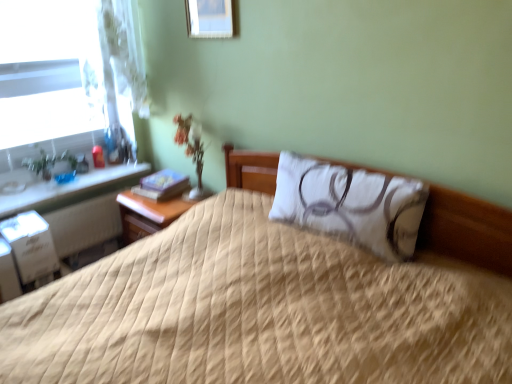
Question: Is wooden picture frame at upper center outside of clear glass window at left?

Choices:
 (A) no
 (B) yes

Answer: (B)

Question: From a real-world perspective, is wooden picture frame at upper center on top of clear glass window at left?

Choices:
 (A) yes
 (B) no

Answer: (A)

Question: Is wooden picture frame at upper center oriented away from clear glass window at left?

Choices:
 (A) yes
 (B) no

Answer: (B)

Question: Considering the relative sizes of wooden picture frame at upper center and clear glass window at left in the image provided, is wooden picture frame at upper center wider than clear glass window at left?

Choices:
 (A) no
 (B) yes

Answer: (A)

Question: From the image's perspective, is wooden picture frame at upper center located beneath clear glass window at left?

Choices:
 (A) no
 (B) yes

Answer: (A)

Question: From the image's perspective, relative to white quilted pillow at center, is beige quilted bed at center above or below?

Choices:
 (A) above
 (B) below

Answer: (B)

Question: Is beige quilted bed at center taller or shorter than white quilted pillow at center?

Choices:
 (A) short
 (B) tall

Answer: (B)

Question: Based on their sizes in the image, would you say beige quilted bed at center is bigger or smaller than white quilted pillow at center?

Choices:
 (A) big
 (B) small

Answer: (A)

Question: Is point (117, 256) positioned closer to the camera than point (314, 228)?

Choices:
 (A) farther
 (B) closer

Answer: (A)

Question: From a real-world perspective, is wooden picture frame at upper center above or below white quilted pillow at center?

Choices:
 (A) above
 (B) below

Answer: (A)

Question: From the image's perspective, is wooden picture frame at upper center located above or below white quilted pillow at center?

Choices:
 (A) below
 (B) above

Answer: (B)

Question: Looking at their shapes, would you say wooden picture frame at upper center is wider or thinner than white quilted pillow at center?

Choices:
 (A) thin
 (B) wide

Answer: (A)

Question: Considering the positions of wooden picture frame at upper center and white quilted pillow at center in the image, is wooden picture frame at upper center taller or shorter than white quilted pillow at center?

Choices:
 (A) tall
 (B) short

Answer: (B)

Question: Considering the positions of beige quilted bed at center and white cardboard file cabinet at lower left in the image, is beige quilted bed at center wider or thinner than white cardboard file cabinet at lower left?

Choices:
 (A) thin
 (B) wide

Answer: (B)

Question: From the image's perspective, is beige quilted bed at center located above or below white cardboard file cabinet at lower left?

Choices:
 (A) above
 (B) below

Answer: (B)